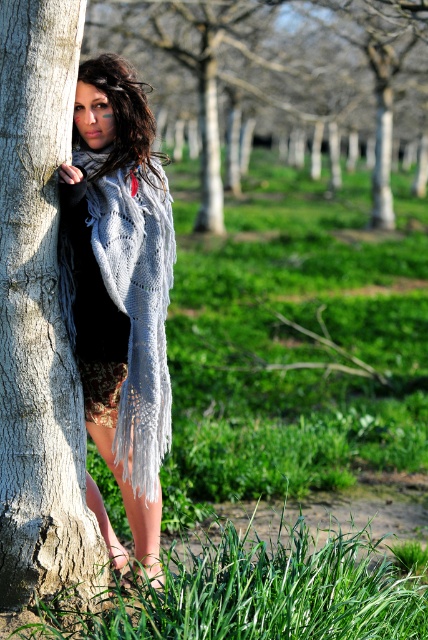
Does smooth gray tree trunk at left have a greater height compared to dark brown hair at left?

Yes, smooth gray tree trunk at left is taller than dark brown hair at left.

How much distance is there between smooth gray tree trunk at left and dark brown hair at left?

smooth gray tree trunk at left and dark brown hair at left are 20.38 meters apart from each other.

Identify the location of smooth gray tree trunk at left. tap(281, 83).

Does smooth gray bark at left lie behind knitted wool shawl at left?

No.

Who is more distant from viewer, [23,394] or [146,572]?

The point [146,572] is more distant.

Where is `smooth gray bark at left`? smooth gray bark at left is located at coordinates pyautogui.click(x=39, y=320).

Which is below, smooth gray tree trunk at left or knitted wool shawl at left?

Positioned lower is knitted wool shawl at left.

Does smooth gray tree trunk at left appear on the right side of knitted wool shawl at left?

Indeed, smooth gray tree trunk at left is positioned on the right side of knitted wool shawl at left.

Is point (204, 177) positioned behind point (95, 170)?

That is True.

This screenshot has width=428, height=640. I want to click on smooth gray tree trunk at left, so click(x=281, y=83).